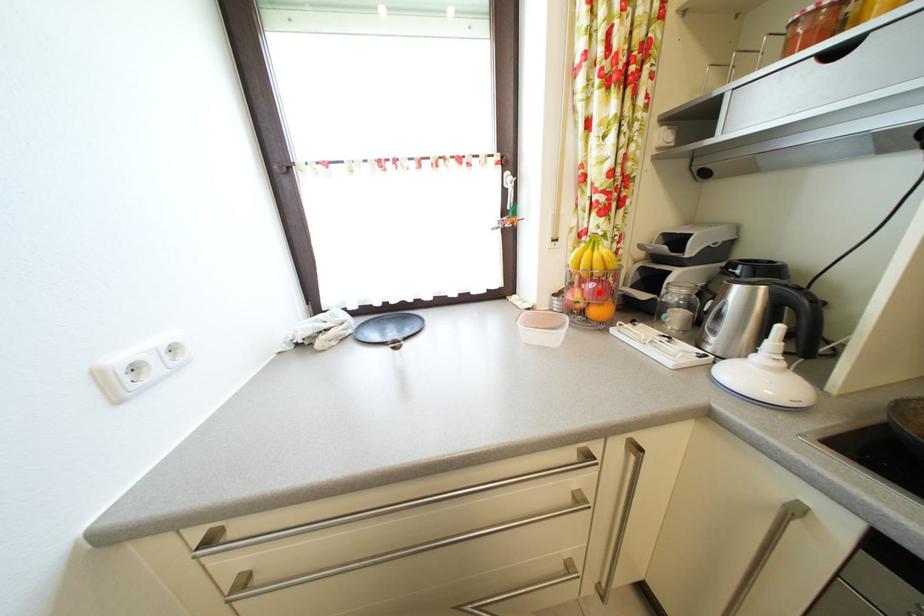
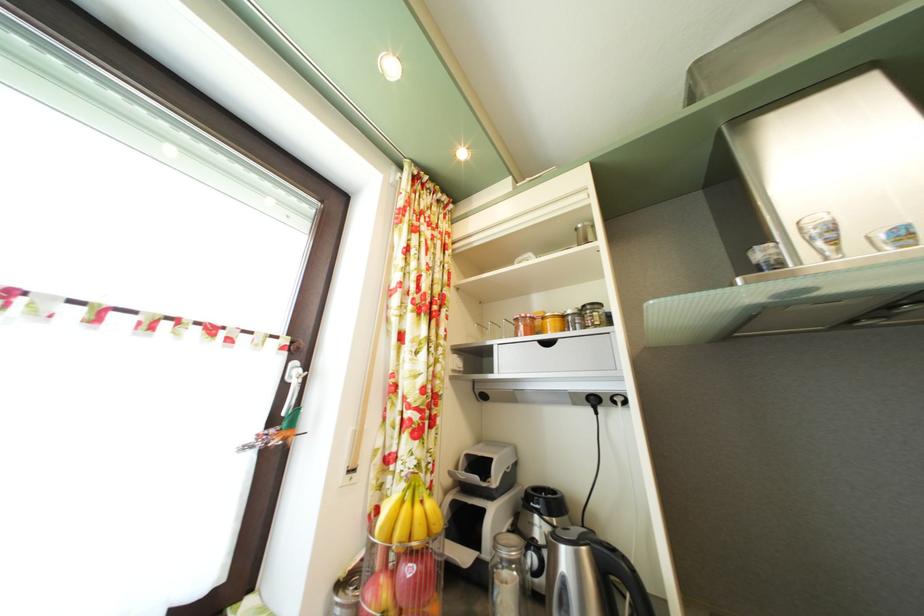
The point at the highlighted location is marked in the first image. Where is the corresponding point in the second image?

(418, 578)